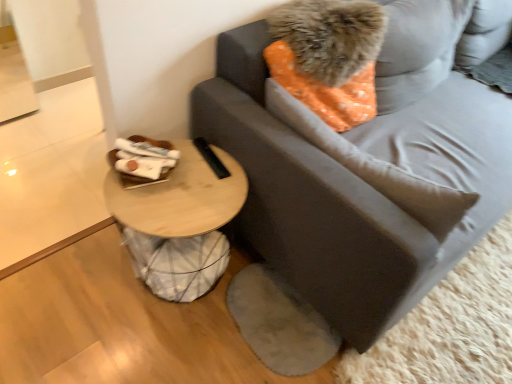
Identify the location of blank space to the left of woodenmaterial/texturetable at lower left. click(x=74, y=284).